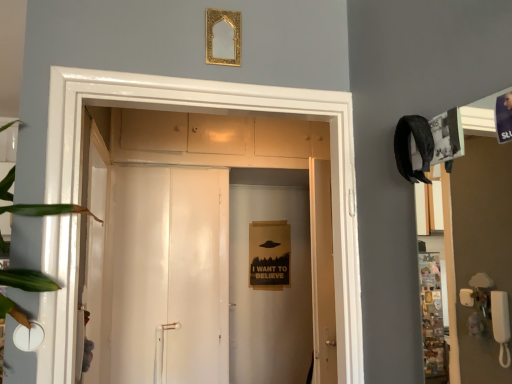
Locate an element on the screen. The width and height of the screenshot is (512, 384). green leafy plant at left is located at coordinates (27, 280).

Locate an element on the screen. The image size is (512, 384). white glossy door at center is located at coordinates (217, 140).

The width and height of the screenshot is (512, 384). In order to click on gold ornate mirror at upper center in this screenshot , I will do pos(223,37).

Who is smaller, white glossy door at center or green leafy plant at left?

green leafy plant at left.

Is point (297, 166) closer or farther from the camera than point (38, 290)?

Point (297, 166) is positioned farther from the camera compared to point (38, 290).

Is white glossy door at center placed right next to green leafy plant at left?

They are not placed beside each other.

Looking at this image, is white glossy door at center looking in the opposite direction of green leafy plant at left?

No, white glossy door at center is not facing the opposite direction of green leafy plant at left.

From the image's perspective, is green leafy plant at left above or below gold ornate mirror at upper center?

Based on their image positions, green leafy plant at left is located beneath gold ornate mirror at upper center.

Is green leafy plant at left not within gold ornate mirror at upper center?

green leafy plant at left is positioned outside gold ornate mirror at upper center.

Relative to gold ornate mirror at upper center, is green leafy plant at left in front or behind?

In the image, green leafy plant at left appears in front of gold ornate mirror at upper center.

Considering the sizes of objects white glossy door at center and gold ornate mirror at upper center in the image provided, who is wider, white glossy door at center or gold ornate mirror at upper center?

white glossy door at center.

Considering the positions of objects white glossy door at center and gold ornate mirror at upper center in the image provided, who is in front, white glossy door at center or gold ornate mirror at upper center?

gold ornate mirror at upper center.

Would you say white glossy door at center is inside or outside gold ornate mirror at upper center?

white glossy door at center lies outside gold ornate mirror at upper center.

Based on the photo, is white glossy door at center oriented towards gold ornate mirror at upper center?

Yes, white glossy door at center is oriented towards gold ornate mirror at upper center.

At what (x,y) coordinates should I click in order to perform the action: click on door below the green leafy plant at left (from a real-world perspective). Please return your answer as a coordinate pair (x, y). This screenshot has height=384, width=512. Looking at the image, I should click on (217, 140).

Is the depth of green leafy plant at left less than that of white glossy door at center?

Yes, the depth of green leafy plant at left is less than that of white glossy door at center.

Between green leafy plant at left and white glossy door at center, which one has larger width?

white glossy door at center.

Is point (18, 316) positioned after point (128, 120)?

No, it is in front of (128, 120).

In terms of width, does gold ornate mirror at upper center look wider or thinner when compared to green leafy plant at left?

Considering their sizes, gold ornate mirror at upper center looks slimmer than green leafy plant at left.

From a real-world perspective, which is physically above, gold ornate mirror at upper center or green leafy plant at left?

From a 3D spatial view, gold ornate mirror at upper center is above.

Is gold ornate mirror at upper center aimed at green leafy plant at left?

No, gold ornate mirror at upper center does not turn towards green leafy plant at left.

Is the depth of gold ornate mirror at upper center less than that of green leafy plant at left?

No, the depth of gold ornate mirror at upper center is greater than that of green leafy plant at left.

Considering the sizes of objects gold ornate mirror at upper center and white glossy door at center in the image provided, who is shorter, gold ornate mirror at upper center or white glossy door at center?

gold ornate mirror at upper center.

This screenshot has width=512, height=384. Identify the location of picture frame above the white glossy door at center (from a real-world perspective). (223, 37).

Is gold ornate mirror at upper center facing towards white glossy door at center?

No, gold ornate mirror at upper center is not oriented towards white glossy door at center.

Which of these two, gold ornate mirror at upper center or white glossy door at center, is smaller?

Smaller between the two is gold ornate mirror at upper center.

You are a GUI agent. You are given a task and a screenshot of the screen. Output one action in this format:
    pyautogui.click(x=<x>, y=<y>)
    Task: Click on the door below the green leafy plant at left (from the image's perspective)
    The height and width of the screenshot is (384, 512).
    Given the screenshot: What is the action you would take?
    pyautogui.click(x=217, y=140)

What are the coordinates of `plant directly beneath the gold ornate mirror at upper center (from a real-world perspective)` in the screenshot? It's located at click(x=27, y=280).

Which object lies further to the anchor point white glossy door at center, gold ornate mirror at upper center or green leafy plant at left?

The object further to white glossy door at center is green leafy plant at left.

Estimate the real-world distances between objects in this image. Which object is further from gold ornate mirror at upper center, white glossy door at center or green leafy plant at left?

green leafy plant at left lies further to gold ornate mirror at upper center than the other object.

Looking at the image, which one is located further to green leafy plant at left, gold ornate mirror at upper center or white glossy door at center?

white glossy door at center is further to green leafy plant at left.

When comparing their distances from green leafy plant at left, does white glossy door at center or gold ornate mirror at upper center seem closer?

gold ornate mirror at upper center lies closer to green leafy plant at left than the other object.

Which object lies further to the anchor point gold ornate mirror at upper center, green leafy plant at left or white glossy door at center?

green leafy plant at left is positioned further to the anchor gold ornate mirror at upper center.

Based on the photo, looking at the image, which one is located closer to white glossy door at center, green leafy plant at left or gold ornate mirror at upper center?

gold ornate mirror at upper center is closer to white glossy door at center.

Identify the location of picture frame positioned between green leafy plant at left and white glossy door at center from near to far. The image size is (512, 384). (223, 37).